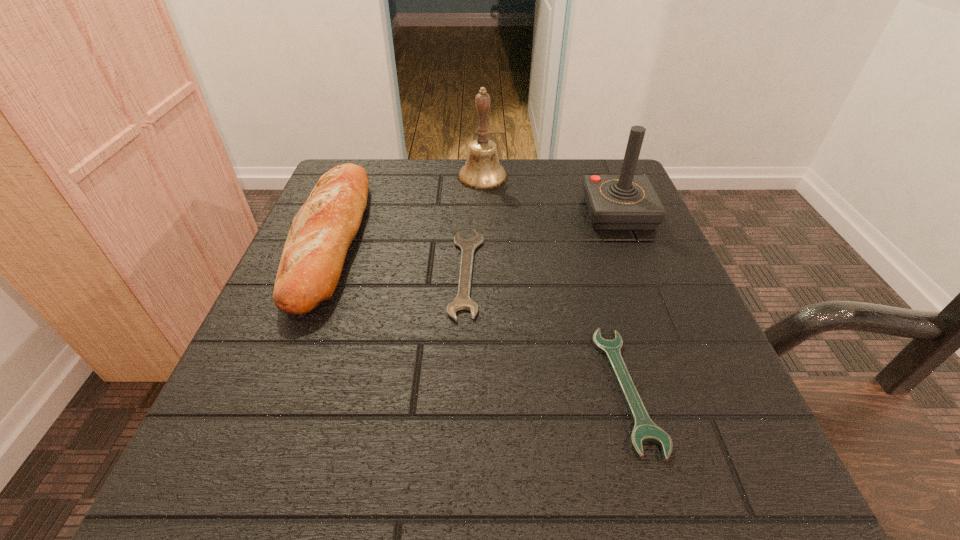
Find the location of `vacant space that is in between the left wrench and the leftmost object`. vacant space that is in between the left wrench and the leftmost object is located at coordinates (397, 255).

Find the location of a particular element. The width and height of the screenshot is (960, 540). vacant area that lies between the joystick and the left wrench is located at coordinates (542, 243).

I want to click on vacant space that is in between the bell and the joystick, so click(x=550, y=195).

The height and width of the screenshot is (540, 960). I want to click on free space between the leftmost object and the joystick, so click(x=473, y=225).

Locate an element on the screen. The image size is (960, 540). free spot between the baguet and the bell is located at coordinates (405, 207).

What are the coordinates of `blank region between the right wrench and the joystick` in the screenshot? It's located at (623, 301).

Identify the location of free point between the third shortest object and the nearer wrench. (478, 314).

Locate an element on the screen. The width and height of the screenshot is (960, 540). object that can be found as the closest to the right wrench is located at coordinates (462, 301).

Locate which object is the second closest to the third tallest object. Please provide its 2D coordinates. Your answer should be formatted as a tuple, i.e. [(x, y)], where the tuple contains the x and y coordinates of a point satisfying the conditions above.

[(482, 171)]